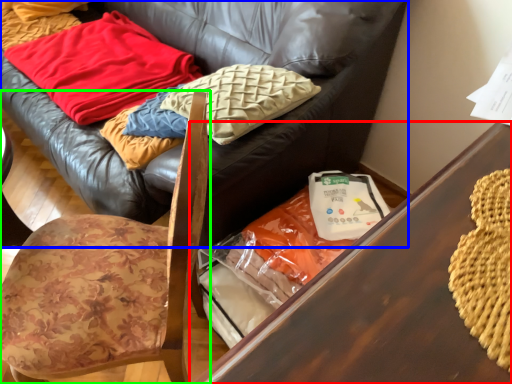
Question: Considering the real-world distances, which object is farthest from table (highlighted by a red box)? studio couch (highlighted by a blue box) or chair (highlighted by a green box)?

Choices:
 (A) studio couch
 (B) chair

Answer: (A)